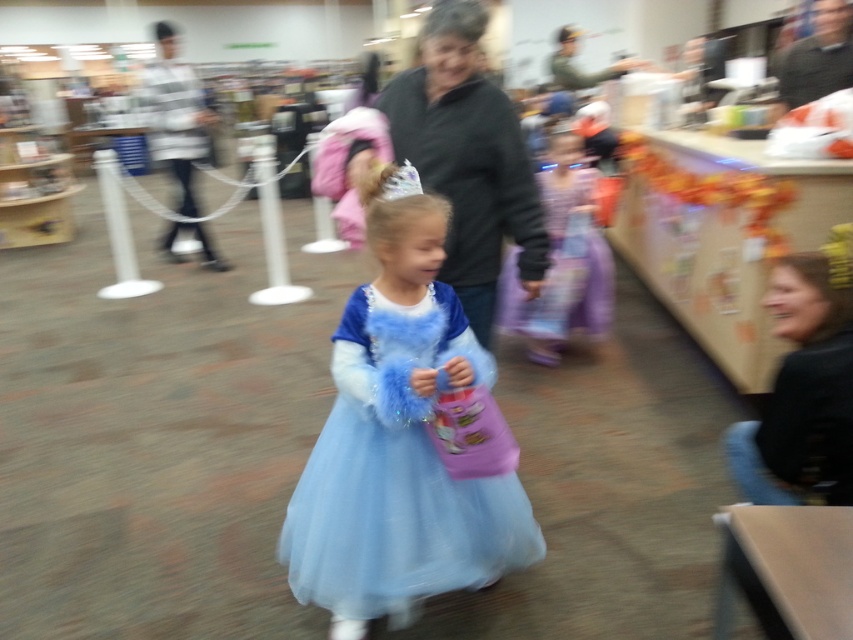
Does light blue tulle dress at center appear under dark gray sweater at center?

Indeed, light blue tulle dress at center is positioned under dark gray sweater at center.

Identify the location of light blue tulle dress at center. (397, 474).

The image size is (853, 640). What do you see at coordinates (397, 474) in the screenshot? I see `light blue tulle dress at center` at bounding box center [397, 474].

Between point (312, 602) and point (544, 192), which one is positioned in front?

Positioned in front is point (312, 602).

This screenshot has width=853, height=640. Identify the location of light blue tulle dress at center. (397, 474).

Is dark gray sweater at center to the right of purple satin dress at center from the viewer's perspective?

Incorrect, dark gray sweater at center is not on the right side of purple satin dress at center.

Can you confirm if dark gray sweater at center is thinner than purple satin dress at center?

Correct, dark gray sweater at center's width is less than purple satin dress at center's.

What do you see at coordinates (468, 157) in the screenshot? The width and height of the screenshot is (853, 640). I see `dark gray sweater at center` at bounding box center [468, 157].

Image resolution: width=853 pixels, height=640 pixels. What are the coordinates of `dark gray sweater at center` in the screenshot? It's located at (468, 157).